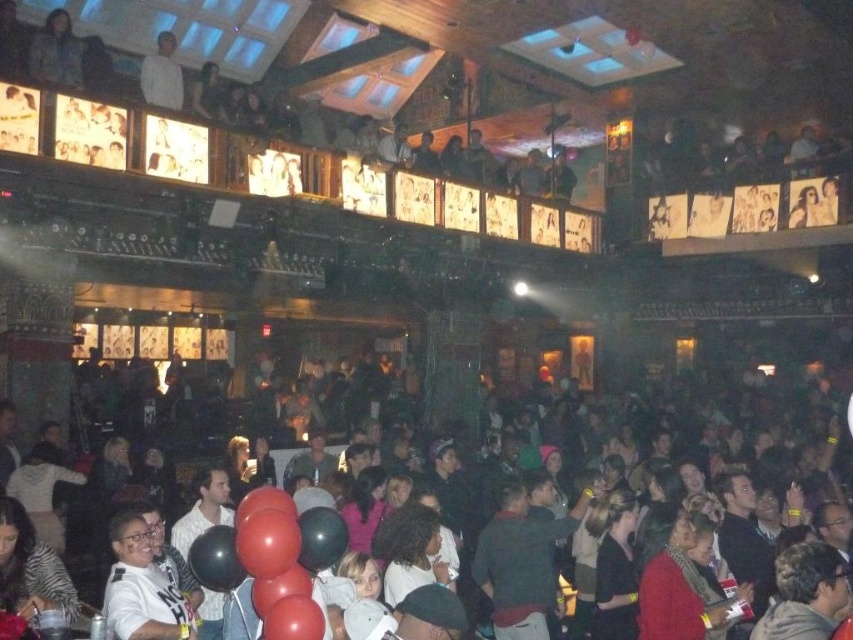
Which is more to the right, black glossy balloons at lower center or black rubber balloon at center?

From the viewer's perspective, black glossy balloons at lower center appears more on the right side.

Is black glossy balloons at lower center smaller than black rubber balloon at center?

No.

Find the location of `black glossy balloons at lower center`. black glossy balloons at lower center is located at coordinates (747, 428).

Is point (241, 580) less distant than point (155, 104)?

That is True.

Is point (206, 564) farther from camera compared to point (167, 35)?

No.

Which is in front, point (216, 529) or point (165, 48)?

Point (216, 529)

Where is `black rubber balloon at center`? This screenshot has height=640, width=853. black rubber balloon at center is located at coordinates (215, 560).

Does black glossy balloons at lower center have a lesser height compared to white matte shirt at upper left?

No.

Who is more distant from viewer, (741, 556) or (181, 100)?

The point (181, 100) is more distant.

Where is `black glossy balloons at lower center`? The image size is (853, 640). black glossy balloons at lower center is located at coordinates (747, 428).